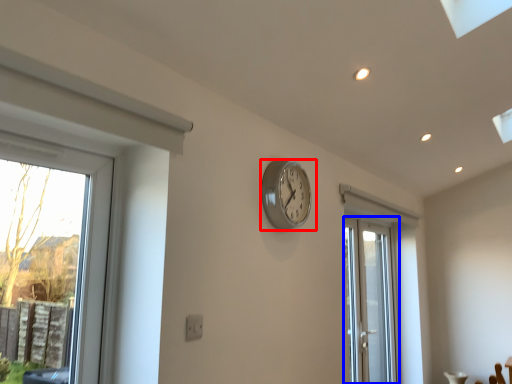
Question: Which object is closer to the camera taking this photo, wall clock (highlighted by a red box) or door (highlighted by a blue box)?

Choices:
 (A) wall clock
 (B) door

Answer: (A)